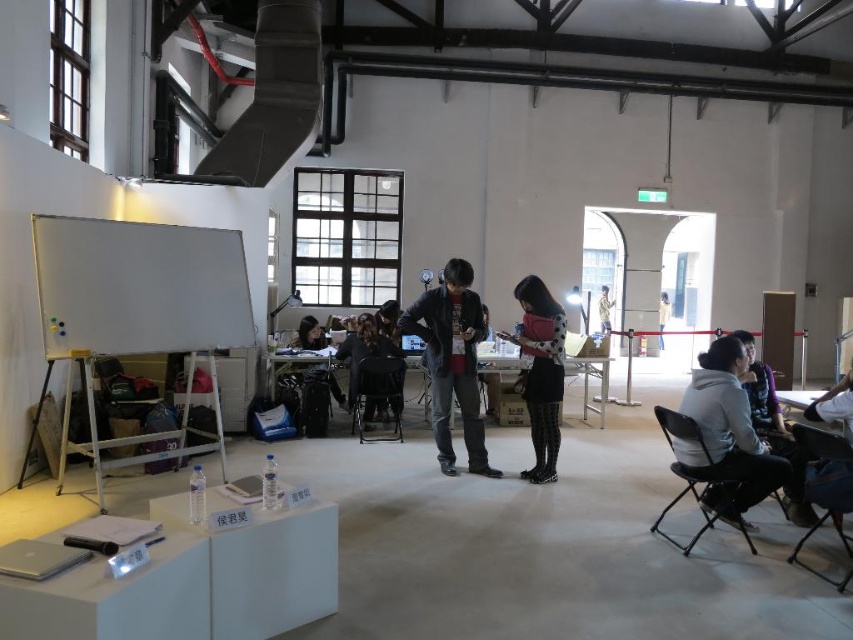
You are standing at the center of the room. You need to sit down. Which object at point [827,490] can you use?

The black fabric chair at lower right is located at point [827,490], so you can sit there.

You are organizing a presentation in the workshop and need to seat two participants. The black fabric chair at lower right and the dark gray fabric chair at center are available. Which chair is closer to the whiteboard?

The dark gray fabric chair at center is closer to the whiteboard because the black fabric chair at lower right is located below it, meaning it is further away from the whiteboard.

You are standing in the workshop and want to locate the point at coordinates (x=138, y=288). Where exactly is this point located?

The point at coordinates (x=138, y=288) is on the white matte projection screen at left.